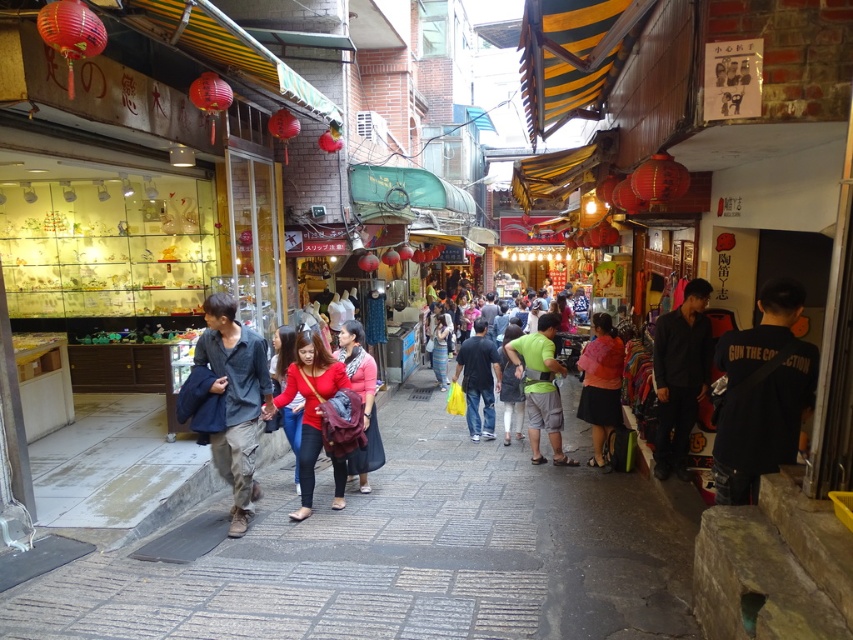
Which is below, green fabric shirt at center or matte pink shirt at center?

Positioned lower is matte pink shirt at center.

Where is `green fabric shirt at center`? This screenshot has height=640, width=853. green fabric shirt at center is located at coordinates (541, 387).

Where is `green fabric shirt at center`? This screenshot has height=640, width=853. green fabric shirt at center is located at coordinates (541, 387).

Can you confirm if red matte jacket at center is smaller than matte green shirt at center?

Indeed, red matte jacket at center has a smaller size compared to matte green shirt at center.

Which is in front, point (306, 458) or point (434, 353)?

Positioned in front is point (306, 458).

Who is more distant from viewer, (312,404) or (448,323)?

Point (448,323)

Where is `red matte jacket at center`? The height and width of the screenshot is (640, 853). red matte jacket at center is located at coordinates (310, 403).

Between red matte jacket at center and pink matte jacket at center, which one has more height?

pink matte jacket at center is taller.

Which is more to the left, red matte jacket at center or pink matte jacket at center?

Positioned to the left is red matte jacket at center.

Which is in front, point (314, 417) or point (605, 378)?

Positioned in front is point (314, 417).

The image size is (853, 640). Identify the location of red matte jacket at center. (310, 403).